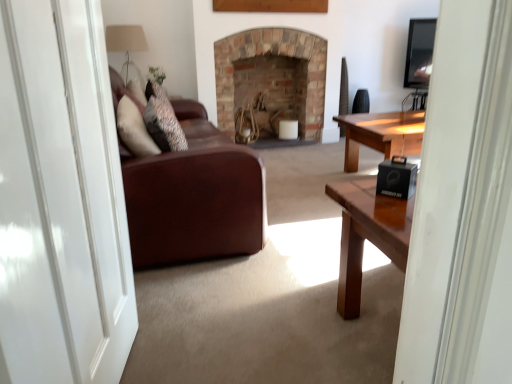
Question: From a real-world perspective, is leather couch at center beneath translucent glass lampshade at upper left?

Choices:
 (A) yes
 (B) no

Answer: (A)

Question: Is leather couch at center outside of translucent glass lampshade at upper left?

Choices:
 (A) yes
 (B) no

Answer: (A)

Question: Is leather couch at center aimed at translucent glass lampshade at upper left?

Choices:
 (A) no
 (B) yes

Answer: (A)

Question: Is translucent glass lampshade at upper left located within leather couch at center?

Choices:
 (A) yes
 (B) no

Answer: (B)

Question: Considering the relative sizes of leather couch at center and translucent glass lampshade at upper left in the image provided, is leather couch at center shorter than translucent glass lampshade at upper left?

Choices:
 (A) no
 (B) yes

Answer: (A)

Question: Does point (147, 196) appear closer or farther from the camera than point (287, 52)?

Choices:
 (A) farther
 (B) closer

Answer: (B)

Question: Is leather couch at center taller or shorter than brick fireplace at center?

Choices:
 (A) tall
 (B) short

Answer: (B)

Question: Choose the correct answer: Is leather couch at center inside brick fireplace at center or outside it?

Choices:
 (A) outside
 (B) inside

Answer: (A)

Question: In the image, is leather couch at center on the left side or the right side of brick fireplace at center?

Choices:
 (A) left
 (B) right

Answer: (A)

Question: Would you say white glossy door at left is to the left or to the right of brick fireplace at center in the picture?

Choices:
 (A) right
 (B) left

Answer: (B)

Question: Is white glossy door at left situated inside brick fireplace at center or outside?

Choices:
 (A) inside
 (B) outside

Answer: (B)

Question: Looking at the image, does white glossy door at left seem bigger or smaller compared to brick fireplace at center?

Choices:
 (A) big
 (B) small

Answer: (B)

Question: Is white glossy door at left wider or thinner than brick fireplace at center?

Choices:
 (A) thin
 (B) wide

Answer: (A)

Question: Does point (142, 34) appear closer or farther from the camera than point (399, 188)?

Choices:
 (A) farther
 (B) closer

Answer: (A)

Question: Considering the relative positions of translucent glass lampshade at upper left and black matte speaker at lower right in the image provided, is translucent glass lampshade at upper left to the left or to the right of black matte speaker at lower right?

Choices:
 (A) left
 (B) right

Answer: (A)